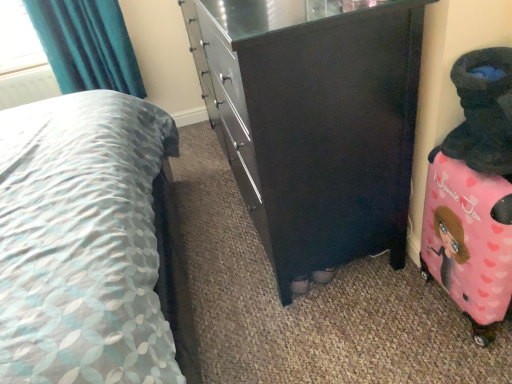
Question: Is patterned fabric bed at center next to white plastic radiator at upper left?

Choices:
 (A) no
 (B) yes

Answer: (A)

Question: From the image's perspective, does patterned fabric bed at center appear lower than white plastic radiator at upper left?

Choices:
 (A) no
 (B) yes

Answer: (B)

Question: Does patterned fabric bed at center appear on the right side of white plastic radiator at upper left?

Choices:
 (A) yes
 (B) no

Answer: (A)

Question: From a real-world perspective, is patterned fabric bed at center physically above white plastic radiator at upper left?

Choices:
 (A) no
 (B) yes

Answer: (B)

Question: From the image's perspective, does patterned fabric bed at center appear higher than white plastic radiator at upper left?

Choices:
 (A) no
 (B) yes

Answer: (A)

Question: Is patterned fabric bed at center positioned with its back to white plastic radiator at upper left?

Choices:
 (A) no
 (B) yes

Answer: (A)

Question: Would you say pink fabric suitcase at right is outside patterned fabric bed at center?

Choices:
 (A) no
 (B) yes

Answer: (B)

Question: Does pink fabric suitcase at right have a greater height compared to patterned fabric bed at center?

Choices:
 (A) no
 (B) yes

Answer: (A)

Question: From a real-world perspective, does pink fabric suitcase at right stand above patterned fabric bed at center?

Choices:
 (A) no
 (B) yes

Answer: (A)

Question: Is pink fabric suitcase at right in contact with patterned fabric bed at center?

Choices:
 (A) no
 (B) yes

Answer: (A)

Question: From the image's perspective, would you say pink fabric suitcase at right is shown under patterned fabric bed at center?

Choices:
 (A) no
 (B) yes

Answer: (B)

Question: Are pink fabric suitcase at right and patterned fabric bed at center far apart?

Choices:
 (A) no
 (B) yes

Answer: (A)

Question: Is pink fabric suitcase at right with teal fabric curtain at upper left?

Choices:
 (A) yes
 (B) no

Answer: (B)